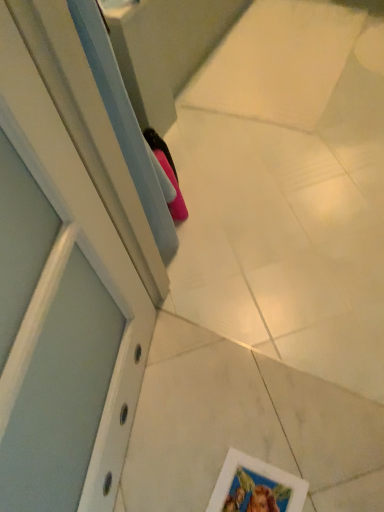
Question: Does pink matte shoe at center have a smaller size compared to white matte picture frame at lower right?

Choices:
 (A) yes
 (B) no

Answer: (B)

Question: Would you say white matte picture frame at lower right is part of pink matte shoe at center's contents?

Choices:
 (A) no
 (B) yes

Answer: (A)

Question: Does pink matte shoe at center have a larger size compared to white matte picture frame at lower right?

Choices:
 (A) yes
 (B) no

Answer: (A)

Question: From the image's perspective, is pink matte shoe at center under white matte picture frame at lower right?

Choices:
 (A) no
 (B) yes

Answer: (A)

Question: Is pink matte shoe at center positioned with its back to white matte picture frame at lower right?

Choices:
 (A) yes
 (B) no

Answer: (B)

Question: Is pink matte shoe at center touching white matte picture frame at lower right?

Choices:
 (A) yes
 (B) no

Answer: (B)

Question: Can we say white matte picture frame at lower right lies outside pink matte shoe at center?

Choices:
 (A) yes
 (B) no

Answer: (A)

Question: Can you confirm if white matte picture frame at lower right is thinner than pink matte shoe at center?

Choices:
 (A) yes
 (B) no

Answer: (B)

Question: From a real-world perspective, is white matte picture frame at lower right located higher than pink matte shoe at center?

Choices:
 (A) yes
 (B) no

Answer: (B)

Question: Is the depth of white matte picture frame at lower right greater than that of pink matte shoe at center?

Choices:
 (A) yes
 (B) no

Answer: (B)

Question: Is pink matte shoe at center surrounded by white matte picture frame at lower right?

Choices:
 (A) yes
 (B) no

Answer: (B)

Question: Does white matte picture frame at lower right have a greater width compared to pink matte shoe at center?

Choices:
 (A) no
 (B) yes

Answer: (B)

Question: From the image's perspective, is white matte picture frame at lower right positioned above or below pink matte shoe at center?

Choices:
 (A) above
 (B) below

Answer: (B)